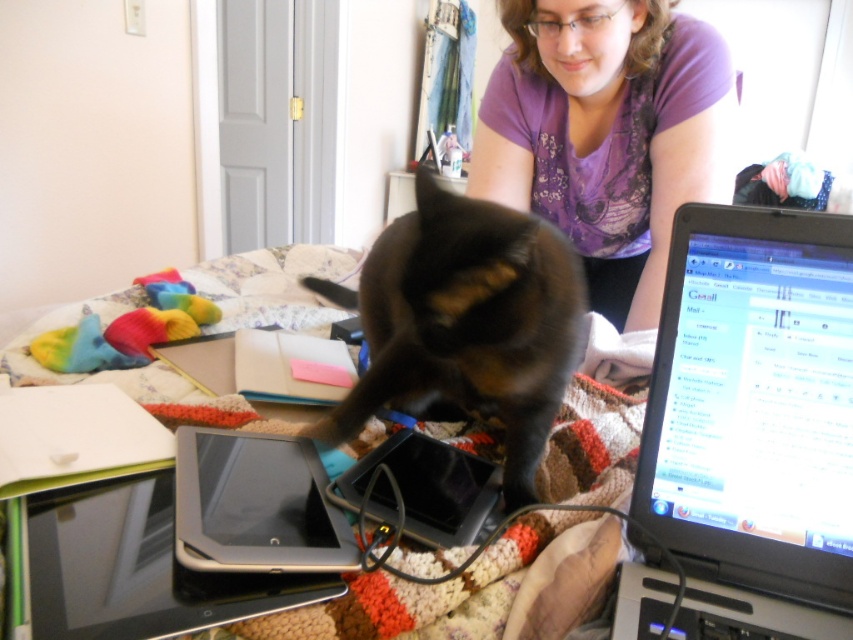
You are navigating a small drone through the cluttered desk area in the image. There are two points of interest marked as point 1 at coordinates point (650, 104) and point 2 at coordinates point (416, 636). To avoid obstacles, you need to determine which point is closer to the front of the desk. Which point should the drone target first?

Point (416, 636) is closer to the front of the desk, so the drone should target this point first because it is in front of point (650, 104).

You are a delivery robot trying to place a package on the desk in the image. The package must be placed exactly at point [137,568]. However, there is an object at that location. What object is blocking the delivery robot from placing the package there?

The silver metallic tablet at lower left is located at point [137,568], so it is blocking the delivery robot from placing the package there.

Looking at this image, you are organizing a desk and need to place the silver metallic laptop at right and the purple printed shirt at upper center. Given their sizes, which item should you place first to ensure they both fit on the desk?

The silver metallic laptop at right is smaller than the purple printed shirt at upper center, so you should place the purple printed shirt at upper center first to accommodate its larger size before placing the smaller laptop.